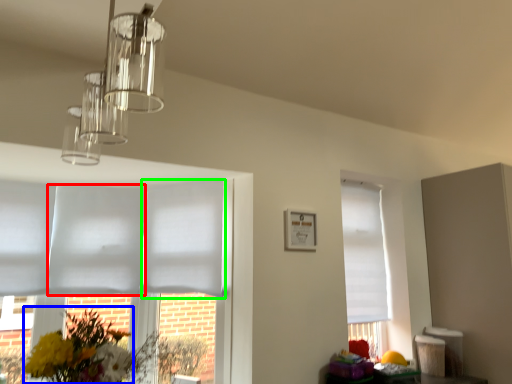
Question: Which object is the farthest from blind (highlighted by a red box)? Choose among these: floral arrangement (highlighted by a blue box) or blind (highlighted by a green box).

Choices:
 (A) floral arrangement
 (B) blind

Answer: (A)